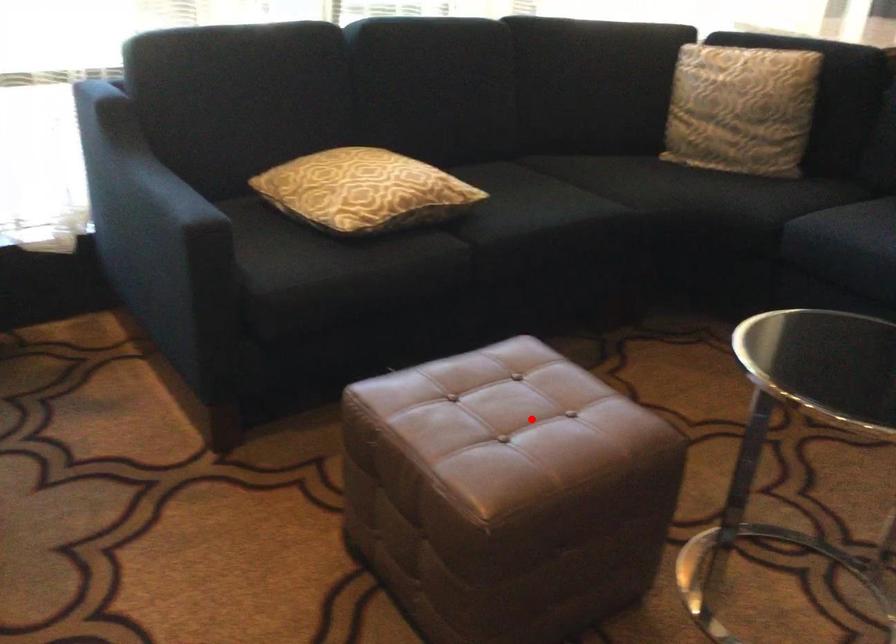
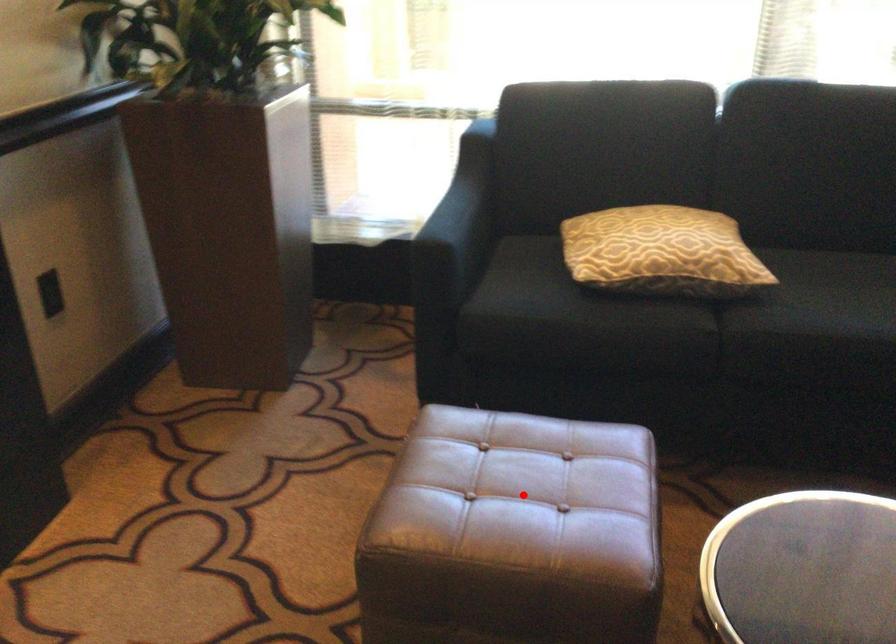
I am providing you with two images of the same scene from different viewpoints. A red point is marked on the first image and another point is marked on the second image. Is the marked point in image1 the same physical position as the marked point in image2?

Yes